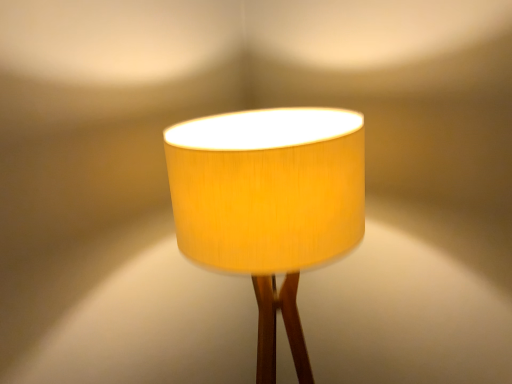
What do you see at coordinates (269, 204) in the screenshot? I see `matte yellow fabric lampshade at center` at bounding box center [269, 204].

Locate an element on the screen. Image resolution: width=512 pixels, height=384 pixels. matte yellow fabric lampshade at center is located at coordinates point(269,204).

Identify the location of matte yellow fabric lampshade at center. The image size is (512, 384). (269, 204).